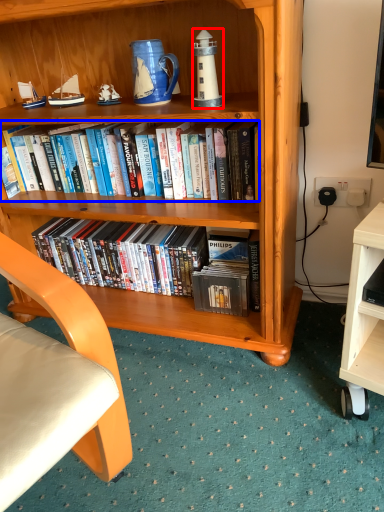
Question: Among these objects, which one is farthest to the camera, lamp (highlighted by a red box) or book (highlighted by a blue box)?

Choices:
 (A) lamp
 (B) book

Answer: (B)